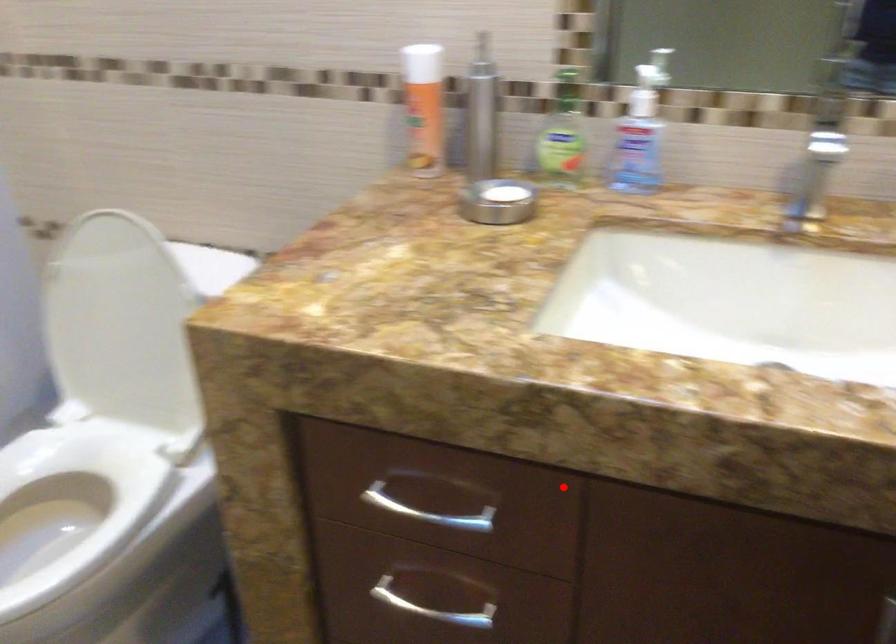
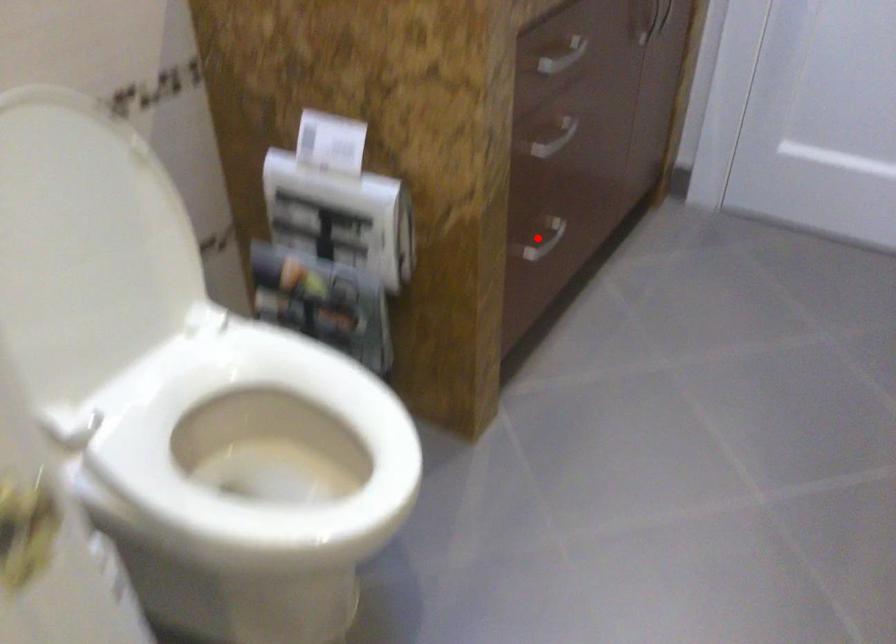
I am providing you with two images of the same scene from different viewpoints. A red point is marked on the first image and another point is marked on the second image. Is the marked point in image1 the same physical position as the marked point in image2?

No